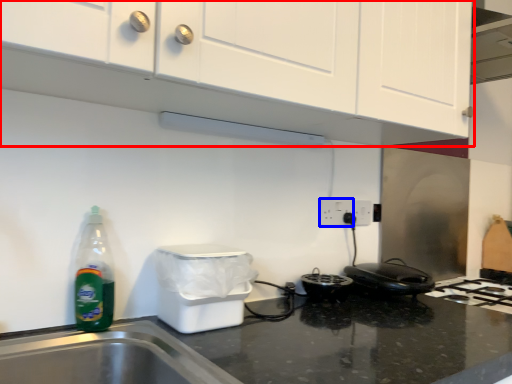
Question: Which object appears farthest to the camera in this image, cabinetry (highlighted by a red box) or electric outlet (highlighted by a blue box)?

Choices:
 (A) cabinetry
 (B) electric outlet

Answer: (B)